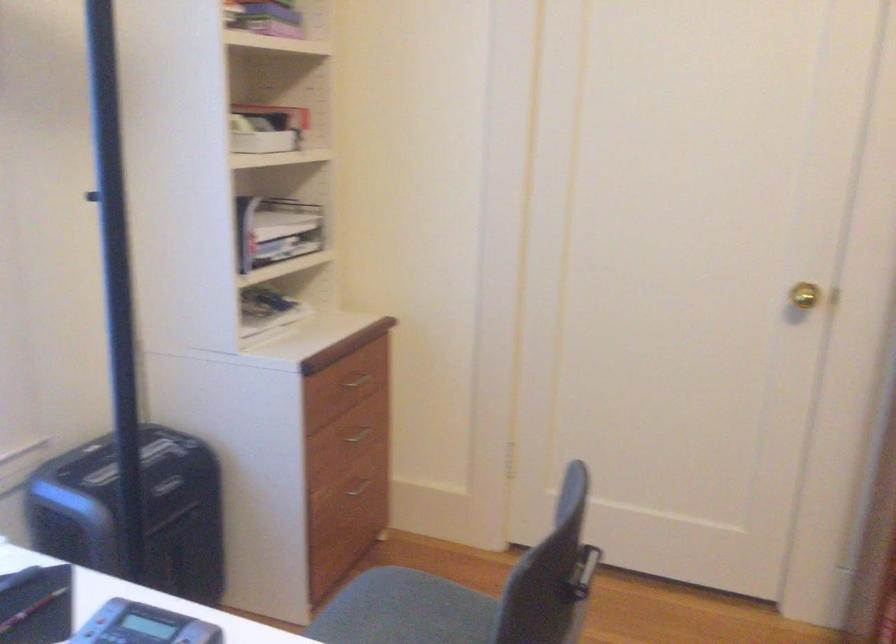
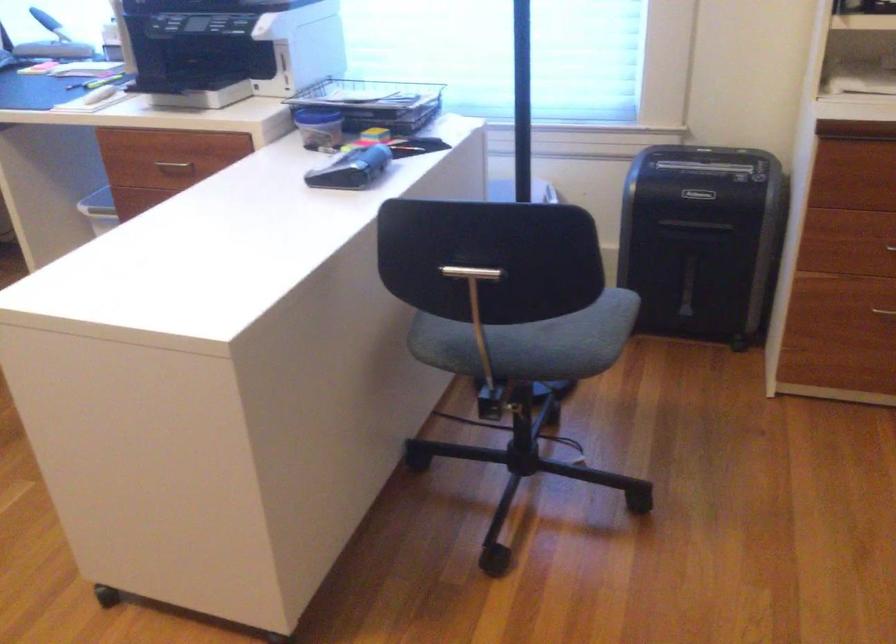
The point at (362, 440) is marked in the first image. Where is the corresponding point in the second image?

(890, 247)